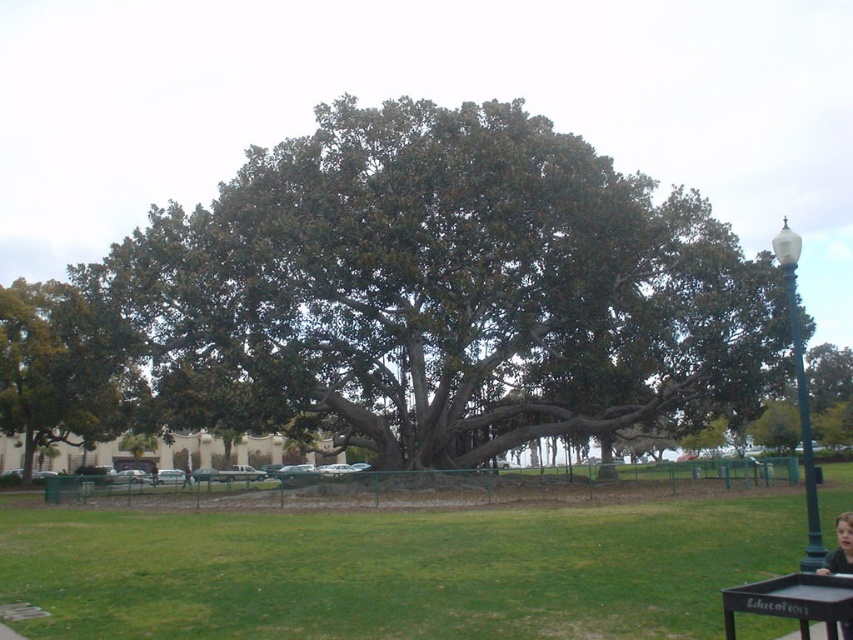
Question: Can you confirm if green leafy tree at left is positioned to the right of green metal pole at right?

Choices:
 (A) yes
 (B) no

Answer: (B)

Question: Which point is closer to the camera?

Choices:
 (A) (724, 445)
 (B) (38, 282)
 (C) (703, 236)
 (D) (822, 568)

Answer: (D)

Question: Which point appears farthest from the camera in this image?

Choices:
 (A) (106, 378)
 (B) (734, 598)

Answer: (A)

Question: Is green metal pole at right further to the viewer compared to green leafy tree at center?

Choices:
 (A) no
 (B) yes

Answer: (A)

Question: Which of the following is the farthest from the observer?

Choices:
 (A) green leafy oak tree at center
 (B) smooth black hair at lower right
 (C) black painted wood picnic table at lower right
 (D) green leafy tree at center

Answer: (D)

Question: Does black painted wood picnic table at lower right have a smaller size compared to green leafy tree at center?

Choices:
 (A) no
 (B) yes

Answer: (B)